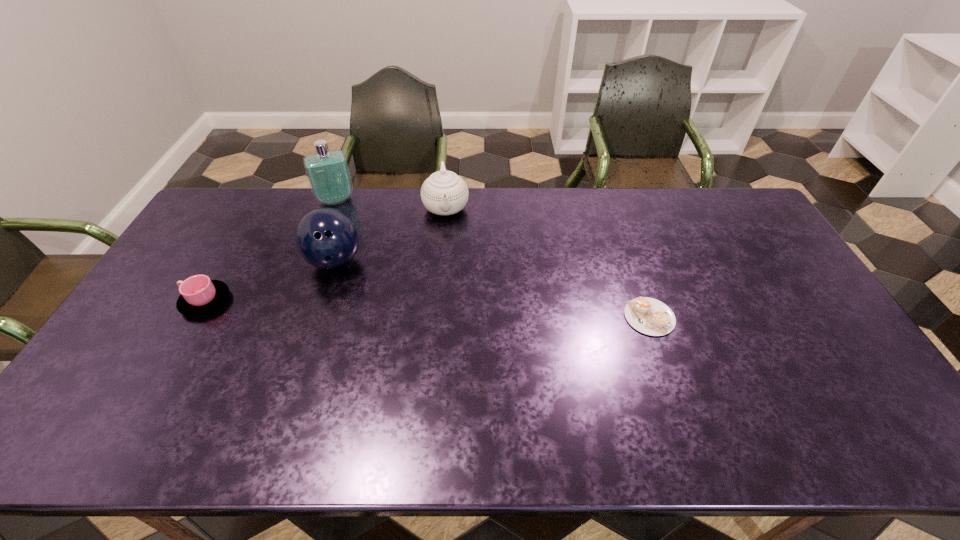
Identify the location of vacant area that lies between the fourth object from left to right and the bowling ball. (391, 234).

Find the location of a particular element. unoccupied position between the chinaware and the tallest object is located at coordinates (391, 204).

Select which object appears as the third closest to the fourth object from left to right. Please provide its 2D coordinates. Your answer should be formatted as a tuple, i.e. [(x, y)], where the tuple contains the x and y coordinates of a point satisfying the conditions above.

[(649, 316)]

Choose which object is the second nearest neighbor to the shortest object. Please provide its 2D coordinates. Your answer should be formatted as a tuple, i.e. [(x, y)], where the tuple contains the x and y coordinates of a point satisfying the conditions above.

[(326, 238)]